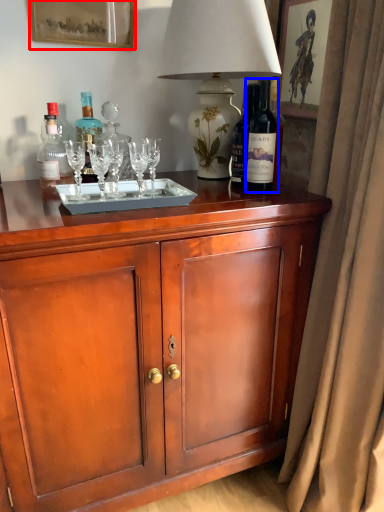
Question: Which object is further to the camera taking this photo, picture frame (highlighted by a red box) or bottle (highlighted by a blue box)?

Choices:
 (A) picture frame
 (B) bottle

Answer: (A)